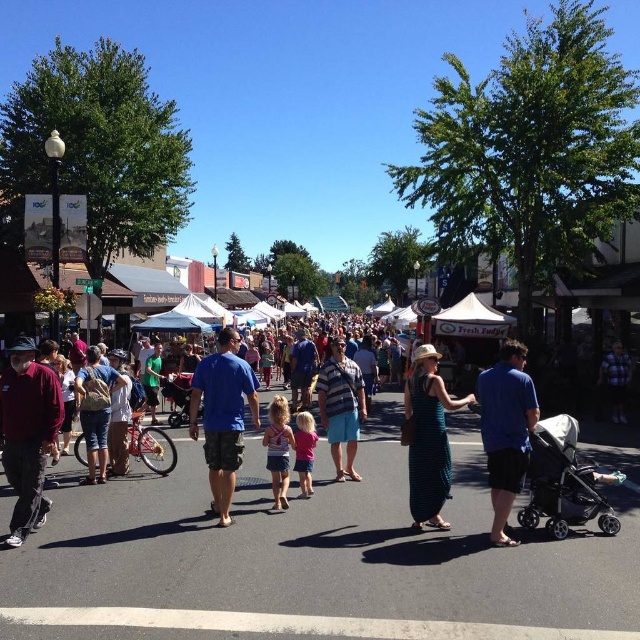
You are a photographer at the event and want to capture a photo that includes both the blue cotton shirt at center and the light pink fabric dress at center. What is the minimum distance you need to maintain between them in your photo to ensure both are fully visible?

The blue cotton shirt at center and light pink fabric dress at center are 31.07 inches apart. To ensure both are fully visible in the photo, the photographer should maintain a minimum distance that allows capturing the space between them, which is 31.07 inches.

You are standing at the origin point in the image. Which direction should you move to reach the blue cotton shirt at center?

The blue cotton shirt at center is located at point 0.652 on the x and 0.348 on the y, so you should move northeast to reach it.

Based on the photo, you are standing at the entrance of the street and want to locate the blue cotton shirt at center. According to the coordinates provided, in which direction should you look to find it?

The blue cotton shirt at center is located at point coordinates of (221, 417). Since the coordinate system is normalized, with the origin at the bottom left corner of the image, the X value of 0.652 indicates it is 65.2 percent from the left edge towards the right, and the Y value of 0.348 means it is 34.8 percent from the bottom edge upwards. Therefore, you should look towards the middle right area of the image to find the blue cotton shirt at center.